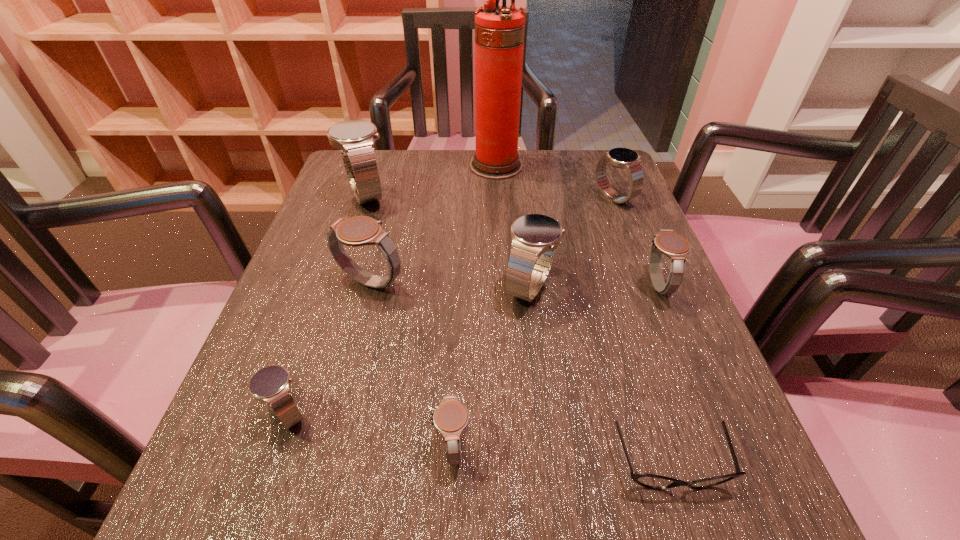
The width and height of the screenshot is (960, 540). Identify the location of object present at the near right corner. point(647,480).

Locate an element on the screen. The width and height of the screenshot is (960, 540). vacant space at the far edge of the desktop is located at coordinates (430, 185).

Locate an element on the screen. The height and width of the screenshot is (540, 960). free space at the near edge of the desktop is located at coordinates pyautogui.click(x=335, y=498).

Locate an element on the screen. This screenshot has height=540, width=960. blank space at the left edge of the desktop is located at coordinates (269, 448).

I want to click on free space at the right edge of the desktop, so click(683, 321).

Find the location of a particular element. Image resolution: width=960 pixels, height=540 pixels. free space at the far left corner is located at coordinates (333, 178).

Locate an element on the screen. The image size is (960, 540). vacant area at the far right corner of the desktop is located at coordinates (585, 189).

Locate an element on the screen. vacant region between the rightmost blue watch and the fire extinguisher is located at coordinates [555, 181].

Find the location of `free point between the nearest gray watch and the smallest blue watch`. free point between the nearest gray watch and the smallest blue watch is located at coordinates (370, 429).

Where is `vacant space that's between the third biggest blue watch and the spectacles`? This screenshot has height=540, width=960. vacant space that's between the third biggest blue watch and the spectacles is located at coordinates (641, 331).